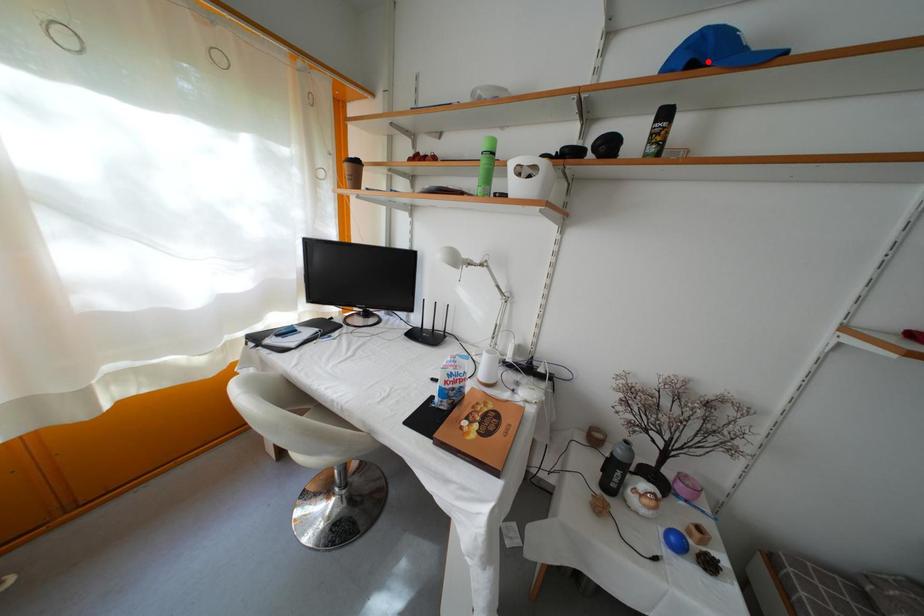
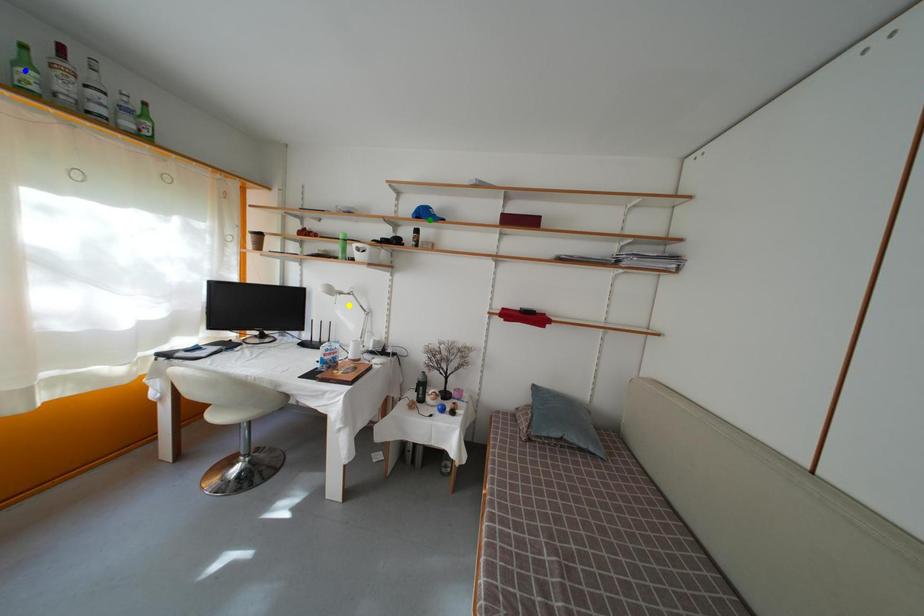
Question: I am providing you with two images of the same scene from different viewpoints. A red point is marked on the first image. You are given multiple points on the second image. Which point in image 2 is actually the same real-world point as the red point in image 1?

Choices:
 (A) green point
 (B) blue point
 (C) yellow point

Answer: (A)